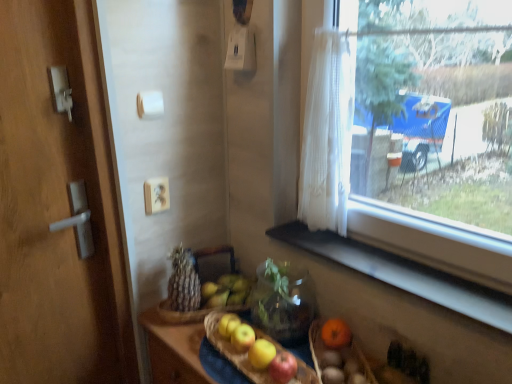
Locate an element on the screen. free location in front of white sheer curtain at window is located at coordinates (352, 254).